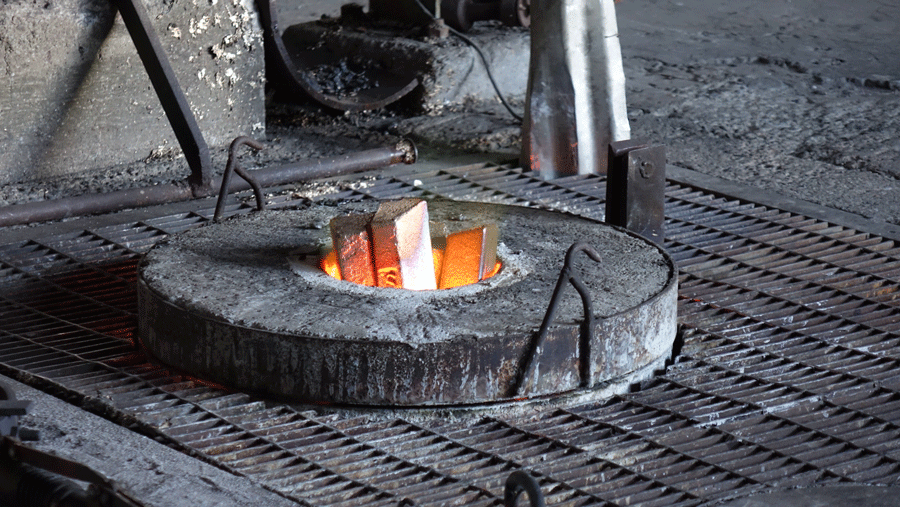
Where is `wall`? wall is located at coordinates (60, 87).